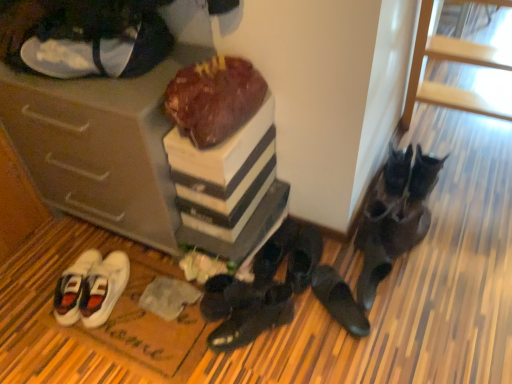
Question: From a real-world perspective, is white canvas sneakers at lower left, which appears as the 7th footwear when viewed from the right, physically above black suede shoes at center, which ranks as the 3th footwear in left-to-right order?

Choices:
 (A) yes
 (B) no

Answer: (A)

Question: Considering the relative sizes of white canvas sneakers at lower left, which appears as the 7th footwear when viewed from the right, and black suede shoes at center, which ranks as the 3th footwear in left-to-right order, in the image provided, is white canvas sneakers at lower left, which appears as the 7th footwear when viewed from the right, shorter than black suede shoes at center, which ranks as the 3th footwear in left-to-right order,?

Choices:
 (A) no
 (B) yes

Answer: (B)

Question: Considering the relative positions of white canvas sneakers at lower left, the first footwear in the left-to-right sequence, and black suede shoes at center, which is counted as the fifth footwear, starting from the right, in the image provided, is white canvas sneakers at lower left, the first footwear in the left-to-right sequence, behind black suede shoes at center, which is counted as the fifth footwear, starting from the right,?

Choices:
 (A) no
 (B) yes

Answer: (B)

Question: Would you consider white canvas sneakers at lower left, the first footwear in the left-to-right sequence, to be distant from black suede shoes at center, which ranks as the 3th footwear in left-to-right order?

Choices:
 (A) yes
 (B) no

Answer: (B)

Question: Is white canvas sneakers at lower left, which appears as the 7th footwear when viewed from the right, facing towards black suede shoes at center, which ranks as the 3th footwear in left-to-right order?

Choices:
 (A) no
 (B) yes

Answer: (A)

Question: From a real-world perspective, is black suede shoes at lower right, the 1th footwear positioned from the right, physically located above or below black leather shoes at lower center, the 5th footwear positioned from the left?

Choices:
 (A) above
 (B) below

Answer: (A)

Question: Looking at their shapes, would you say black suede shoes at lower right, which appears as the 7th footwear when viewed from the left, is wider or thinner than black leather shoes at lower center, the 5th footwear positioned from the left?

Choices:
 (A) wide
 (B) thin

Answer: (A)

Question: Is point (390, 192) closer or farther from the camera than point (303, 288)?

Choices:
 (A) farther
 (B) closer

Answer: (A)

Question: Is black suede shoes at lower right, the 1th footwear positioned from the right, to the left or to the right of black leather shoes at lower center, the third footwear when ordered from right to left, in the image?

Choices:
 (A) right
 (B) left

Answer: (A)

Question: Based on their positions, is matte brown cabinet at lower left located to the left or right of black leather shoes at center, the fourth footwear in the right-to-left sequence?

Choices:
 (A) left
 (B) right

Answer: (A)

Question: From a real-world perspective, is matte brown cabinet at lower left physically located above or below black leather shoes at center, the fourth footwear in the right-to-left sequence?

Choices:
 (A) above
 (B) below

Answer: (A)

Question: Considering the positions of matte brown cabinet at lower left and black leather shoes at center, the fourth footwear from the left, in the image, is matte brown cabinet at lower left taller or shorter than black leather shoes at center, the fourth footwear from the left,?

Choices:
 (A) tall
 (B) short

Answer: (A)

Question: Looking at the image, does matte brown cabinet at lower left seem bigger or smaller compared to black leather shoes at center, the fourth footwear in the right-to-left sequence?

Choices:
 (A) small
 (B) big

Answer: (B)

Question: From the image's perspective, relative to black leather shoes at lower right, acting as the 2th footwear starting from the right, is chocolate cake at center above or below?

Choices:
 (A) above
 (B) below

Answer: (A)

Question: From their relative heights in the image, would you say chocolate cake at center is taller or shorter than black leather shoes at lower right, acting as the 2th footwear starting from the right?

Choices:
 (A) tall
 (B) short

Answer: (A)